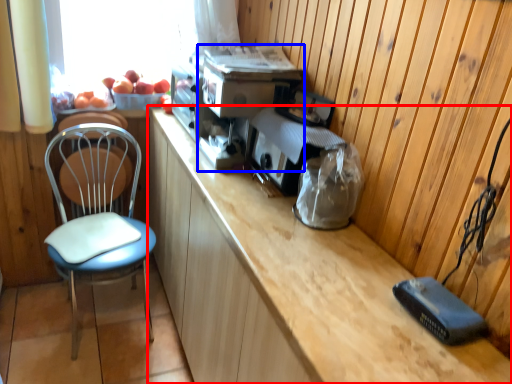
Question: Among these objects, which one is farthest to the camera, cabinetry (highlighted by a red box) or appliance (highlighted by a blue box)?

Choices:
 (A) cabinetry
 (B) appliance

Answer: (B)